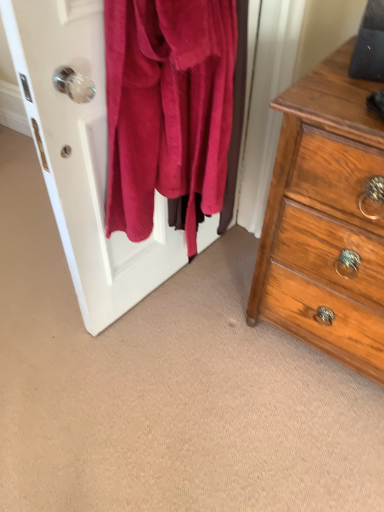
What is the approximate height of fuzzy pink sweater at left?

The height of fuzzy pink sweater at left is 33.38 inches.

In order to face fuzzy pink sweater at left, should I rotate leftwards or rightwards?

Rotate left and turn 4.653 degrees.

You are a GUI agent. You are given a task and a screenshot of the screen. Output one action in this format:
    pyautogui.click(x=<x>, y=<y>)
    Task: Click on the fuzzy pink sweater at left
    The height and width of the screenshot is (512, 384).
    Given the screenshot: What is the action you would take?
    pyautogui.click(x=83, y=158)

This screenshot has width=384, height=512. Describe the element at coordinates (83, 158) in the screenshot. I see `fuzzy pink sweater at left` at that location.

The image size is (384, 512). Describe the element at coordinates (325, 220) in the screenshot. I see `wooden chest of drawers at right` at that location.

Find the location of a particular element. wooden chest of drawers at right is located at coordinates (325, 220).

Identify the location of fuzzy pink sweater at left. (83, 158).

Which is more to the right, wooden chest of drawers at right or fuzzy pink sweater at left?

wooden chest of drawers at right.

Which object is closer to the camera taking this photo, wooden chest of drawers at right or fuzzy pink sweater at left?

fuzzy pink sweater at left is in front.

Considering the positions of point (366, 325) and point (103, 226), is point (366, 325) closer or farther from the camera than point (103, 226)?

Point (366, 325) appears to be closer to the viewer than point (103, 226).

From the image's perspective, is wooden chest of drawers at right positioned above or below fuzzy pink sweater at left?

wooden chest of drawers at right is below fuzzy pink sweater at left.

From a real-world perspective, is wooden chest of drawers at right physically above fuzzy pink sweater at left?

No, from a real-world perspective, wooden chest of drawers at right is not over fuzzy pink sweater at left

Does wooden chest of drawers at right have a lesser width compared to fuzzy pink sweater at left?

No.

Considering the sizes of wooden chest of drawers at right and fuzzy pink sweater at left in the image, is wooden chest of drawers at right taller or shorter than fuzzy pink sweater at left?

Clearly, wooden chest of drawers at right is taller compared to fuzzy pink sweater at left.

Who is smaller, wooden chest of drawers at right or fuzzy pink sweater at left?

With smaller size is fuzzy pink sweater at left.

Is fuzzy pink sweater at left surrounded by wooden chest of drawers at right?

No, fuzzy pink sweater at left is not surrounded by wooden chest of drawers at right.

Is wooden chest of drawers at right far away from fuzzy pink sweater at left?

No.

Is wooden chest of drawers at right oriented towards fuzzy pink sweater at left?

No, wooden chest of drawers at right is not aimed at fuzzy pink sweater at left.

How many degrees apart are the facing directions of wooden chest of drawers at right and fuzzy pink sweater at left?

There is a 96.8-degree angle between the facing directions of wooden chest of drawers at right and fuzzy pink sweater at left.

Identify the location of chest of drawers on the right side of fuzzy pink sweater at left. (325, 220).

Which object is positioned more to the right, fuzzy pink sweater at left or wooden chest of drawers at right?

wooden chest of drawers at right.

Based on the photo, is fuzzy pink sweater at left positioned in front of wooden chest of drawers at right?

That is True.

Is point (71, 20) farther from viewer compared to point (324, 149)?

No, (71, 20) is closer to viewer.

From the image's perspective, which is below, fuzzy pink sweater at left or wooden chest of drawers at right?

From the image's view, wooden chest of drawers at right is below.

From a real-world perspective, is fuzzy pink sweater at left under wooden chest of drawers at right?

No, from a real-world perspective, fuzzy pink sweater at left is not below wooden chest of drawers at right.

Can you confirm if fuzzy pink sweater at left is wider than wooden chest of drawers at right?

No, fuzzy pink sweater at left is not wider than wooden chest of drawers at right.

Is fuzzy pink sweater at left taller or shorter than wooden chest of drawers at right?

In the image, fuzzy pink sweater at left appears to be shorter than wooden chest of drawers at right.

Based on their sizes in the image, would you say fuzzy pink sweater at left is bigger or smaller than wooden chest of drawers at right?

In the image, fuzzy pink sweater at left appears to be smaller than wooden chest of drawers at right.

Is fuzzy pink sweater at left completely or partially outside of wooden chest of drawers at right?

Yes, fuzzy pink sweater at left is outside of wooden chest of drawers at right.

Consider the image. Is fuzzy pink sweater at left not close to wooden chest of drawers at right?

No, there isn't a large distance between fuzzy pink sweater at left and wooden chest of drawers at right.

Is fuzzy pink sweater at left looking in the opposite direction of wooden chest of drawers at right?

fuzzy pink sweater at left does not have its back to wooden chest of drawers at right.

Can you tell me how much fuzzy pink sweater at left and wooden chest of drawers at right differ in facing direction?

There is a 96.8-degree angle between the facing directions of fuzzy pink sweater at left and wooden chest of drawers at right.

Identify the location of screen door above the wooden chest of drawers at right (from a real-world perspective). (83, 158).

You are a GUI agent. You are given a task and a screenshot of the screen. Output one action in this format:
    pyautogui.click(x=<x>, y=<y>)
    Task: Click on the screen door above the wooden chest of drawers at right (from the image's perspective)
    Image resolution: width=384 pixels, height=512 pixels.
    Given the screenshot: What is the action you would take?
    (83, 158)

Where is `screen door above the wooden chest of drawers at right (from a real-world perspective)`? The height and width of the screenshot is (512, 384). screen door above the wooden chest of drawers at right (from a real-world perspective) is located at coordinates (83, 158).